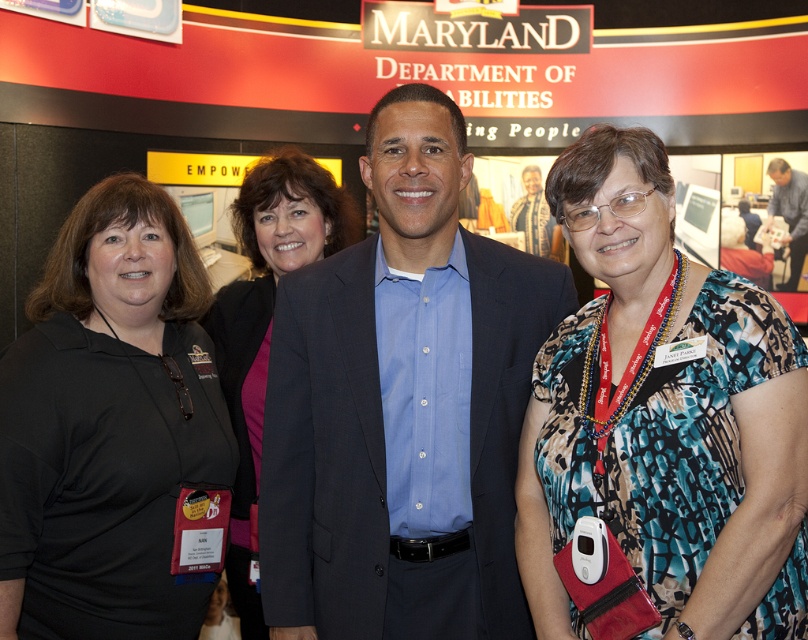
You are at the Maryland Department of Disabilities event and need to approach the person standing at point (x=537, y=180). There is another person at point (x=562, y=346) blocking your path. Can you walk directly to the desired location?

Point (x=562, y=346) is in front of point (x=537, y=180), so the person at point (x=562, y=346) is blocking your path. You cannot walk directly to point (x=537, y=180) without moving around them.

You are organizing a photo shoot and need to ensure that the black matte shirt at left and the matte blue shirt at center are visible in the frame. Based on their sizes in the image, which shirt might require you to adjust the camera angle to ensure it is fully captured?

The matte blue shirt at center occupies more space in the image than the black matte shirt at left, so it might require adjusting the camera angle to ensure it is fully captured.